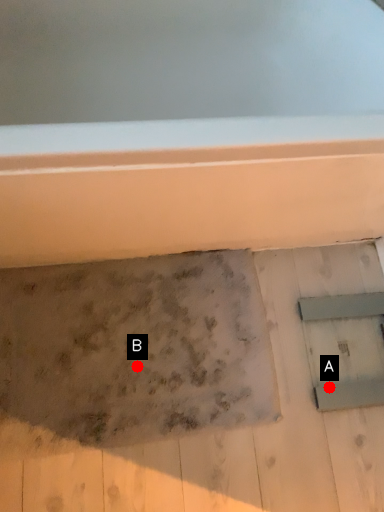
Question: Two points are circled on the image, labeled by A and B beside each circle. Which point is farther to the camera?

Choices:
 (A) A is further
 (B) B is further

Answer: (A)